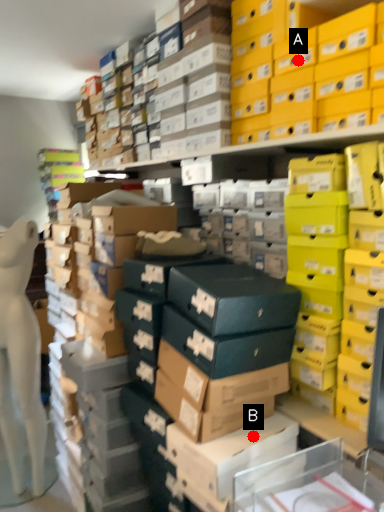
Question: Two points are circled on the image, labeled by A and B beside each circle. Which point appears farthest from the camera in this image?

Choices:
 (A) A is further
 (B) B is further

Answer: (A)